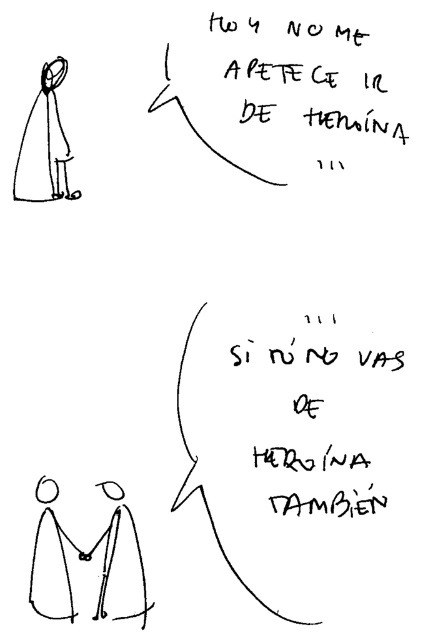
Question: Among these objects, which one is nearest to the camera?

Choices:
 (A) smooth black figures at center
 (B) black line drawing figure at upper left

Answer: (A)

Question: Can you confirm if smooth black figures at center is positioned below black line drawing figure at upper left?

Choices:
 (A) no
 (B) yes

Answer: (B)

Question: Can you confirm if smooth black figures at center is positioned to the left of black line drawing figure at upper left?

Choices:
 (A) no
 (B) yes

Answer: (A)

Question: Does smooth black figures at center have a greater width compared to black line drawing figure at upper left?

Choices:
 (A) no
 (B) yes

Answer: (B)

Question: Which of the following is the farthest from the observer?

Choices:
 (A) (132, 618)
 (B) (12, 193)

Answer: (B)